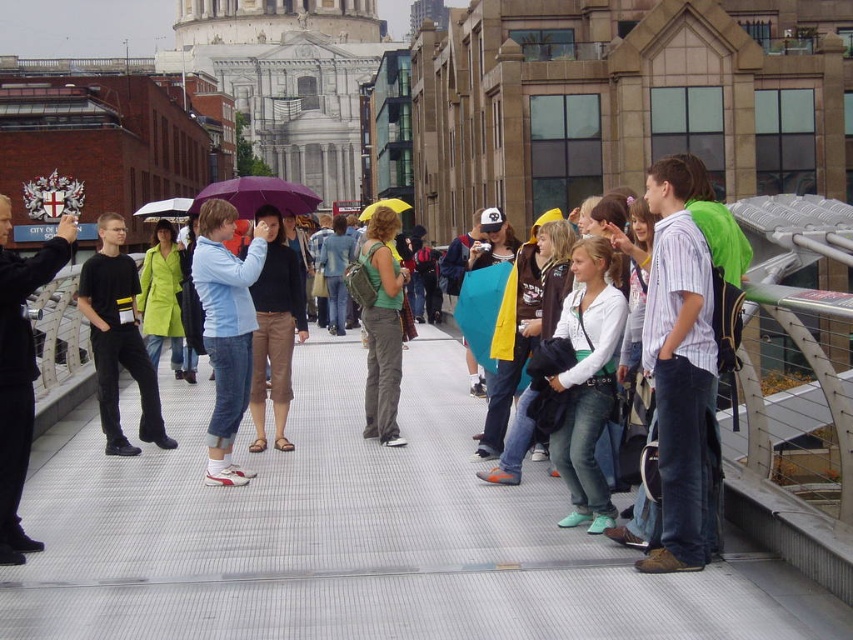
You are a photographer trying to capture a shot of the black matte shirt at left and the purple matte umbrella at center. Based on their sizes in the image, which one would appear closer to the camera?

The black matte shirt at left is smaller than the purple matte umbrella at center, so the purple matte umbrella at center appears closer to the camera since smaller objects in the distance appear smaller while larger objects closer appear larger.

You are standing on the pedestrian bridge and want to take a photo of the two points mentioned. Which point, point (25, 396) or point (219, 195), will appear larger in your camera view because it is closer to you?

Point (25, 396) will appear larger in your camera view because it is closer to the viewer than point (219, 195).

You are standing on a pedestrian bridge and want to reach the point at coordinates point (166, 486). If your walking speed is 3 feet per second, how many seconds will it take you to reach that point?

The distance between you and point (166, 486) is 152.39 feet. At a speed of 3 feet per second, it would take approximately 50.8 seconds to reach the point.